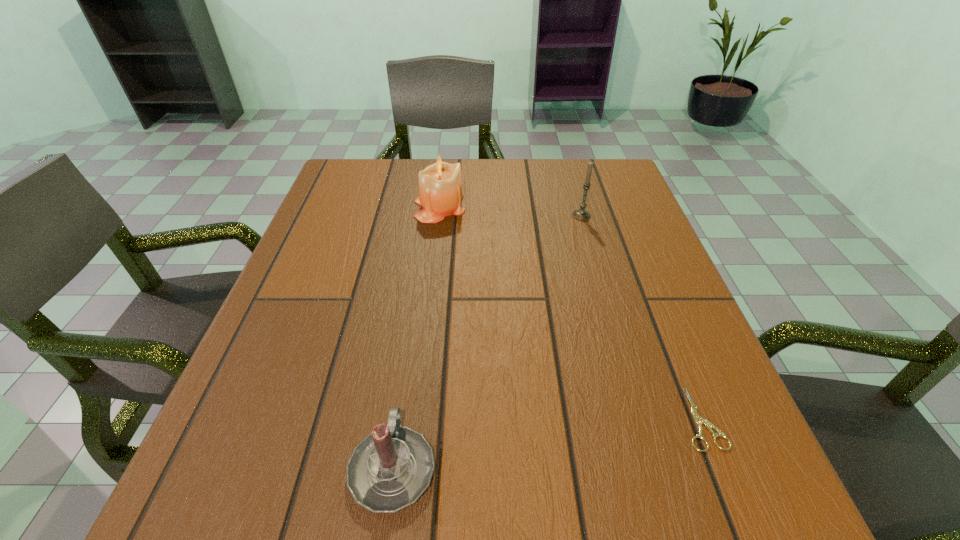
The image size is (960, 540). Find the location of `object that is at the far edge`. object that is at the far edge is located at coordinates (440, 187).

I want to click on object situated at the near edge, so click(x=391, y=468).

Find the location of a particular element. This screenshot has height=540, width=960. candle that is at the right edge is located at coordinates (580, 214).

Locate an element on the screen. shears situated at the right edge is located at coordinates (699, 420).

At what (x,y) coordinates should I click in order to perform the action: click on vacant space at the far edge. Please return your answer as a coordinate pair (x, y). Looking at the image, I should click on (489, 171).

In the image, there is a desktop. Identify the location of vacant space at the near edge. Image resolution: width=960 pixels, height=540 pixels. (492, 500).

In the image, there is a desktop. At what (x,y) coordinates should I click in order to perform the action: click on vacant space at the left edge. Please return your answer as a coordinate pair (x, y). This screenshot has width=960, height=540. Looking at the image, I should click on (349, 271).

What are the coordinates of `free location at the right edge` in the screenshot? It's located at (647, 273).

Identify the location of free space at the near left corner of the desktop. Image resolution: width=960 pixels, height=540 pixels. (219, 470).

In the image, there is a desktop. Identify the location of blank space at the far right corner. (598, 160).